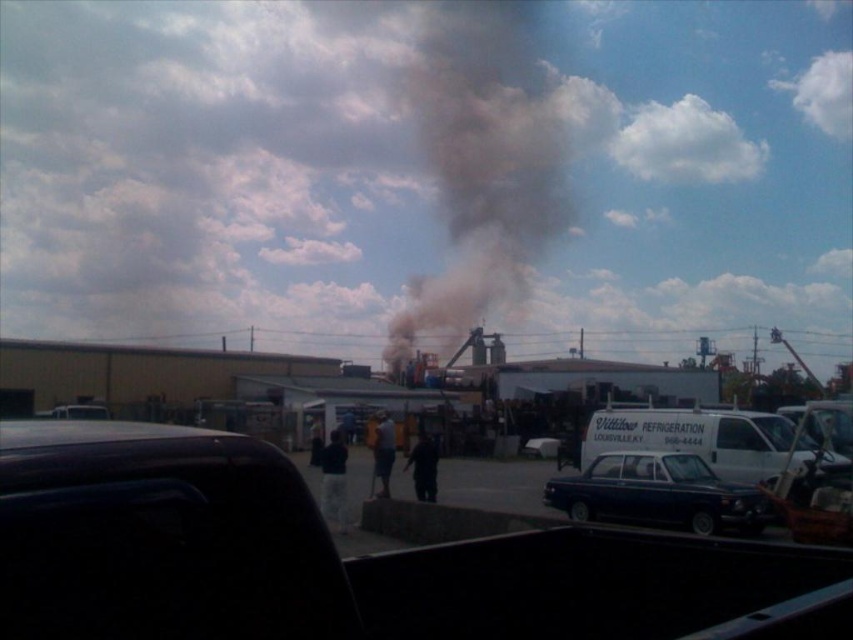
You are a drone operator tasked with capturing aerial footage of the industrial area. You notice the white fluffy cloud at upper right and the shiny black sedan at center. Which object would block the drone camera view more if positioned directly in front of the camera?

The white fluffy cloud at upper right would block the drone camera view more because it has a larger size compared to the shiny black sedan at center.

You are a safety inspector observing the industrial scene. You notice two types of smoke, the black smoke at center and the dark gray smoke at center. Which smoke is closer to you based on their positions?

The black smoke at center is closer to you because it is in front of the dark gray smoke at center.